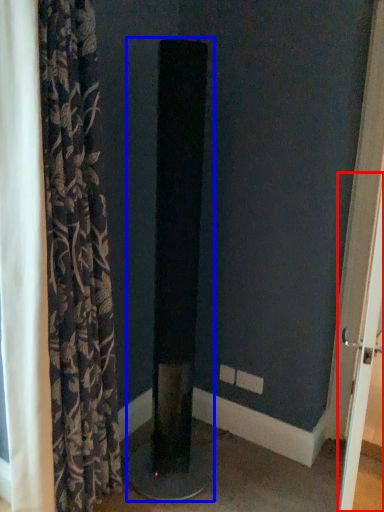
Question: Which of the following is the farthest to the observer, screen door (highlighted by a red box) or pillar (highlighted by a blue box)?

Choices:
 (A) screen door
 (B) pillar

Answer: (B)